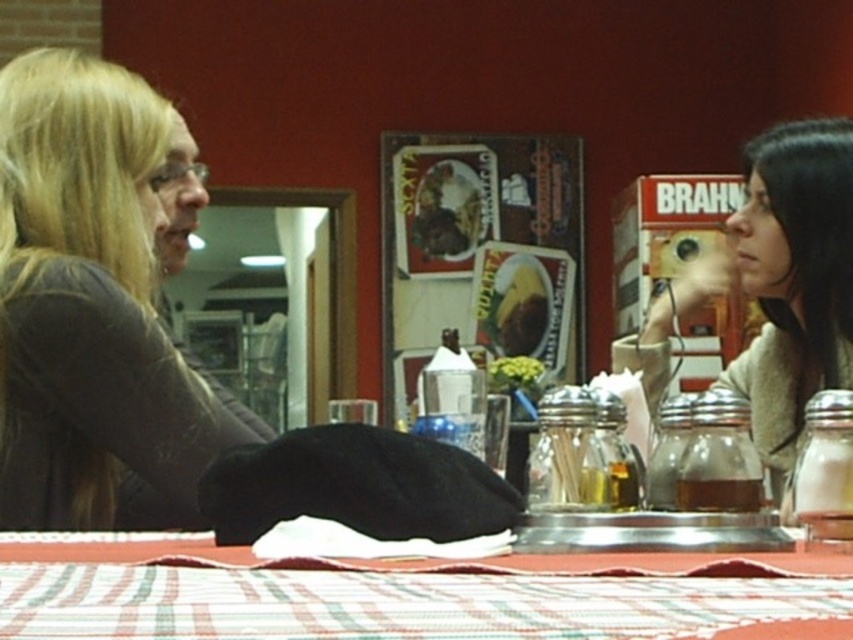
Question: Is dark gray sweater at left wider than striped cotton tablecloth at center?

Choices:
 (A) yes
 (B) no

Answer: (B)

Question: Can you confirm if dark gray sweater at left is positioned to the right of beige fabric jacket at right?

Choices:
 (A) no
 (B) yes

Answer: (A)

Question: Which point is closer to the camera?

Choices:
 (A) (392, 593)
 (B) (776, 269)
 (C) (178, 417)

Answer: (A)

Question: Which of the following is the closest to the observer?

Choices:
 (A) striped cotton tablecloth at center
 (B) beige fabric jacket at right
 (C) dark gray sweater at left

Answer: (A)

Question: Is dark gray sweater at left smaller than striped cotton tablecloth at center?

Choices:
 (A) yes
 (B) no

Answer: (B)

Question: Which point is closer to the camera taking this photo?

Choices:
 (A) (775, 324)
 (B) (531, 570)
 (C) (97, 141)

Answer: (B)